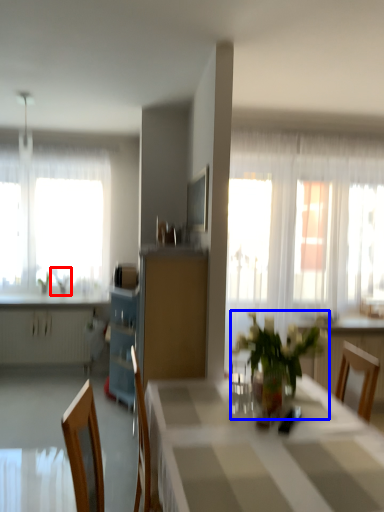
Question: Which object is closer to the camera taking this photo, plant (highlighted by a red box) or houseplant (highlighted by a blue box)?

Choices:
 (A) plant
 (B) houseplant

Answer: (B)